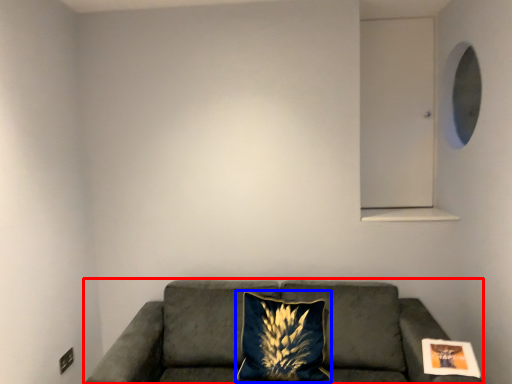
Question: Which object appears farthest to the camera in this image, studio couch (highlighted by a red box) or pillow (highlighted by a blue box)?

Choices:
 (A) studio couch
 (B) pillow

Answer: (B)